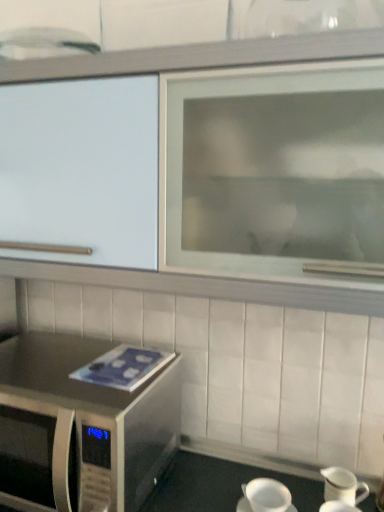
Measure the distance between white glossy cabinet at upper center and camera.

27.67 inches.

What is the approximate width of white glossy cabinet at upper center?

14.40 inches.

What do you see at coordinates (343, 486) in the screenshot? The height and width of the screenshot is (512, 384). I see `white glossy pitcher at lower right, arranged as the 1th tableware when viewed from the back` at bounding box center [343, 486].

Where is `white matte coffee cup at lower center`? Image resolution: width=384 pixels, height=512 pixels. white matte coffee cup at lower center is located at coordinates pyautogui.click(x=267, y=495).

The height and width of the screenshot is (512, 384). What do you see at coordinates (267, 495) in the screenshot?
I see `white matte coffee cup at lower center` at bounding box center [267, 495].

Identify the location of white glossy cabinet at upper center. (201, 56).

Considering the positions of points (337, 498) and (327, 510), is point (337, 498) farther from camera compared to point (327, 510)?

Yes.

Can you confirm if white glossy pitcher at lower right, positioned as the second tableware in front-to-back order, is thinner than white glossy pitcher at lower right, positioned as the second tableware in back-to-front order?

Yes, white glossy pitcher at lower right, positioned as the second tableware in front-to-back order, is thinner than white glossy pitcher at lower right, positioned as the second tableware in back-to-front order.

Is white glossy pitcher at lower right, arranged as the 1th tableware when viewed from the back, to the right of white glossy pitcher at lower right, the 1th tableware positioned from the front, from the viewer's perspective?

Yes, white glossy pitcher at lower right, arranged as the 1th tableware when viewed from the back, is to the right of white glossy pitcher at lower right, the 1th tableware positioned from the front.

From the image's perspective, is white glossy pitcher at lower right, positioned as the second tableware in front-to-back order, on white glossy pitcher at lower right, positioned as the second tableware in back-to-front order?

Correct, white glossy pitcher at lower right, positioned as the second tableware in front-to-back order, appears higher than white glossy pitcher at lower right, positioned as the second tableware in back-to-front order, in the image.

Who is shorter, white matte coffee cup at lower center or white glossy pitcher at lower right, positioned as the second tableware in front-to-back order?

white matte coffee cup at lower center.

In the scene shown: From a real-world perspective, is white matte coffee cup at lower center located beneath white glossy pitcher at lower right, positioned as the second tableware in front-to-back order?

Yes, from a real-world perspective, white matte coffee cup at lower center is under white glossy pitcher at lower right, positioned as the second tableware in front-to-back order.

From the picture: Considering the sizes of white matte coffee cup at lower center and white glossy pitcher at lower right, positioned as the second tableware in front-to-back order, in the image, is white matte coffee cup at lower center wider or thinner than white glossy pitcher at lower right, positioned as the second tableware in front-to-back order,?

Considering their sizes, white matte coffee cup at lower center looks broader than white glossy pitcher at lower right, positioned as the second tableware in front-to-back order.

Is white matte coffee cup at lower center positioned behind white glossy pitcher at lower right, positioned as the second tableware in front-to-back order?

No, white matte coffee cup at lower center is in front of white glossy pitcher at lower right, positioned as the second tableware in front-to-back order.

What's the angular difference between white glossy pitcher at lower right, the 1th tableware positioned from the front, and stainless steel microwave at lower left's facing directions?

They differ by 1.09 degrees in their facing directions.

Find the location of a particular element. This screenshot has width=384, height=512. microwave oven above the white glossy pitcher at lower right, the 1th tableware positioned from the front (from a real-world perspective) is located at coordinates (81, 426).

From the image's perspective, is white glossy pitcher at lower right, positioned as the second tableware in back-to-front order, located above or below stainless steel microwave at lower left?

white glossy pitcher at lower right, positioned as the second tableware in back-to-front order, is below stainless steel microwave at lower left.

Can you confirm if white glossy pitcher at lower right, positioned as the second tableware in back-to-front order, is bigger than stainless steel microwave at lower left?

Incorrect, white glossy pitcher at lower right, positioned as the second tableware in back-to-front order, is not larger than stainless steel microwave at lower left.

Is white matte coffee cup at lower center next to stainless steel microwave at lower left and touching it?

white matte coffee cup at lower center and stainless steel microwave at lower left are clearly separated.

Does white matte coffee cup at lower center turn towards stainless steel microwave at lower left?

No, white matte coffee cup at lower center is not turned towards stainless steel microwave at lower left.

Is white matte coffee cup at lower center in front of or behind stainless steel microwave at lower left in the image?

white matte coffee cup at lower center is positioned farther from the viewer than stainless steel microwave at lower left.

Image resolution: width=384 pixels, height=512 pixels. There is a white matte coffee cup at lower center. What are the coordinates of `microwave oven above it (from a real-world perspective)` in the screenshot? It's located at (81, 426).

Considering the positions of points (322, 472) and (336, 306), is point (322, 472) farther from camera compared to point (336, 306)?

Yes, point (322, 472) is behind point (336, 306).

Is white glossy pitcher at lower right, positioned as the second tableware in front-to-back order, at the left side of white glossy cabinet at upper center?

Incorrect, white glossy pitcher at lower right, positioned as the second tableware in front-to-back order, is not on the left side of white glossy cabinet at upper center.

Identify the location of tableware that is the 1st one below the white glossy cabinet at upper center (from a real-world perspective). The image size is (384, 512). (343, 486).

Is white glossy pitcher at lower right, positioned as the second tableware in front-to-back order, positioned beyond the bounds of white glossy cabinet at upper center?

Absolutely, white glossy pitcher at lower right, positioned as the second tableware in front-to-back order, is external to white glossy cabinet at upper center.

From a real-world perspective, is stainless steel microwave at lower left positioned under white glossy pitcher at lower right, positioned as the second tableware in back-to-front order, based on gravity?

No, from a real-world perspective, stainless steel microwave at lower left is not beneath white glossy pitcher at lower right, positioned as the second tableware in back-to-front order.

Can you tell me how much stainless steel microwave at lower left and white glossy pitcher at lower right, the 1th tableware positioned from the front, differ in facing direction?

stainless steel microwave at lower left and white glossy pitcher at lower right, the 1th tableware positioned from the front, are facing 1.09 degrees away from each other.

Which is correct: stainless steel microwave at lower left is inside white glossy pitcher at lower right, positioned as the second tableware in back-to-front order, or outside of it?

stainless steel microwave at lower left is outside white glossy pitcher at lower right, positioned as the second tableware in back-to-front order.

Which is in front, stainless steel microwave at lower left or white glossy pitcher at lower right, positioned as the second tableware in back-to-front order?

stainless steel microwave at lower left is closer to the camera.

Can you see white matte coffee cup at lower center touching white glossy pitcher at lower right, the 1th tableware positioned from the front?

No, white matte coffee cup at lower center is not making contact with white glossy pitcher at lower right, the 1th tableware positioned from the front.

How many degrees apart are the facing directions of white matte coffee cup at lower center and white glossy pitcher at lower right, the 1th tableware positioned from the front?

They differ by 6.64e-05 degrees in their facing directions.

You are a GUI agent. You are given a task and a screenshot of the screen. Output one action in this format:
    pyautogui.click(x=<x>, y=<y>)
    Task: Click on the tableware below the white matte coffee cup at lower center (from the image's perspective)
    Image resolution: width=384 pixels, height=512 pixels.
    Given the screenshot: What is the action you would take?
    pyautogui.click(x=337, y=507)

Considering the relative positions of white matte coffee cup at lower center and white glossy pitcher at lower right, positioned as the second tableware in back-to-front order, in the image provided, is white matte coffee cup at lower center to the left or to the right of white glossy pitcher at lower right, positioned as the second tableware in back-to-front order,?

Clearly, white matte coffee cup at lower center is on the left of white glossy pitcher at lower right, positioned as the second tableware in back-to-front order, in the image.

The width and height of the screenshot is (384, 512). What are the coordinates of `tableware that is above the white glossy pitcher at lower right, the 1th tableware positioned from the front (from the image's perspective)` in the screenshot? It's located at (343, 486).

The width and height of the screenshot is (384, 512). What are the coordinates of `coffee cup that is in front of the white glossy pitcher at lower right, positioned as the second tableware in front-to-back order` in the screenshot? It's located at (267, 495).

Looking at the image, which one is located further to white glossy pitcher at lower right, positioned as the second tableware in front-to-back order, white matte coffee cup at lower center or white glossy pitcher at lower right, positioned as the second tableware in back-to-front order?

Based on the image, white matte coffee cup at lower center appears to be further to white glossy pitcher at lower right, positioned as the second tableware in front-to-back order.

Based on the photo, looking at the image, which one is located further to white glossy pitcher at lower right, positioned as the second tableware in back-to-front order, white glossy cabinet at upper center or white glossy pitcher at lower right, arranged as the 1th tableware when viewed from the back?

white glossy cabinet at upper center is positioned further to the anchor white glossy pitcher at lower right, positioned as the second tableware in back-to-front order.

From the image, which object appears to be farther from white glossy pitcher at lower right, positioned as the second tableware in front-to-back order, white glossy cabinet at upper center or white glossy pitcher at lower right, the 1th tableware positioned from the front?

white glossy cabinet at upper center is further to white glossy pitcher at lower right, positioned as the second tableware in front-to-back order.

Looking at the image, which one is located closer to white glossy cabinet at upper center, white glossy pitcher at lower right, positioned as the second tableware in back-to-front order, or stainless steel microwave at lower left?

stainless steel microwave at lower left is positioned closer to the anchor white glossy cabinet at upper center.

In the scene shown: From the image, which object appears to be farther from white glossy pitcher at lower right, the 1th tableware positioned from the front, stainless steel microwave at lower left or white matte coffee cup at lower center?

stainless steel microwave at lower left.

In the scene shown: Estimate the real-world distances between objects in this image. Which object is closer to white glossy pitcher at lower right, the 1th tableware positioned from the front, white glossy cabinet at upper center or stainless steel microwave at lower left?

Among the two, stainless steel microwave at lower left is located nearer to white glossy pitcher at lower right, the 1th tableware positioned from the front.

From the image, which object appears to be farther from stainless steel microwave at lower left, white glossy pitcher at lower right, positioned as the second tableware in back-to-front order, or white glossy cabinet at upper center?

Based on the image, white glossy pitcher at lower right, positioned as the second tableware in back-to-front order, appears to be further to stainless steel microwave at lower left.

Which object lies nearer to the anchor point stainless steel microwave at lower left, white matte coffee cup at lower center or white glossy cabinet at upper center?

white glossy cabinet at upper center is positioned closer to the anchor stainless steel microwave at lower left.

This screenshot has width=384, height=512. Identify the location of tableware between white glossy cabinet at upper center and white matte coffee cup at lower center vertically. (343, 486).

Locate an element on the screen. This screenshot has width=384, height=512. coffee cup located between stainless steel microwave at lower left and white glossy pitcher at lower right, arranged as the 1th tableware when viewed from the back, in the left-right direction is located at coordinates (267, 495).

The width and height of the screenshot is (384, 512). Find the location of `microwave oven between white glossy cabinet at upper center and white matte coffee cup at lower center in the up-down direction`. microwave oven between white glossy cabinet at upper center and white matte coffee cup at lower center in the up-down direction is located at coordinates (81, 426).

Identify the location of coffee cup between white glossy cabinet at upper center and white glossy pitcher at lower right, the 1th tableware positioned from the front, in the vertical direction. The height and width of the screenshot is (512, 384). (267, 495).